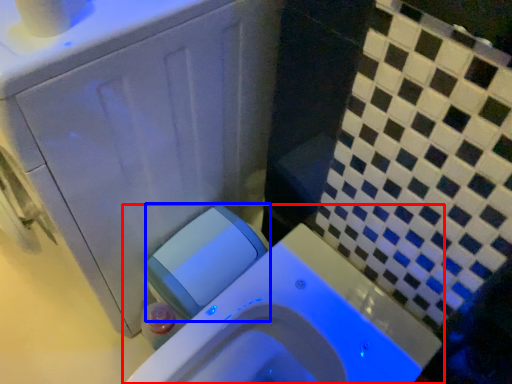
Question: Which of the following is the closest to the observer, toilet (highlighted by a red box) or water tank (highlighted by a blue box)?

Choices:
 (A) toilet
 (B) water tank

Answer: (A)